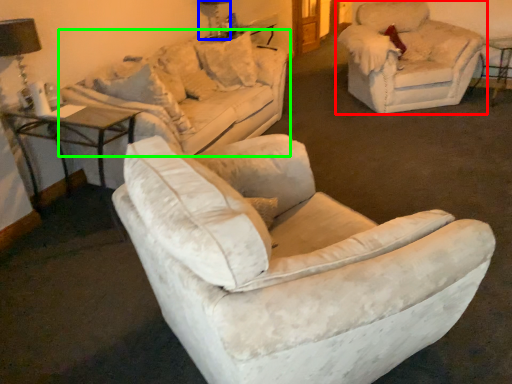
Question: Based on their relative distances, which object is nearer to chair (highlighted by a red box)? Choose from table lamp (highlighted by a blue box) and studio couch (highlighted by a green box).

Choices:
 (A) table lamp
 (B) studio couch

Answer: (B)